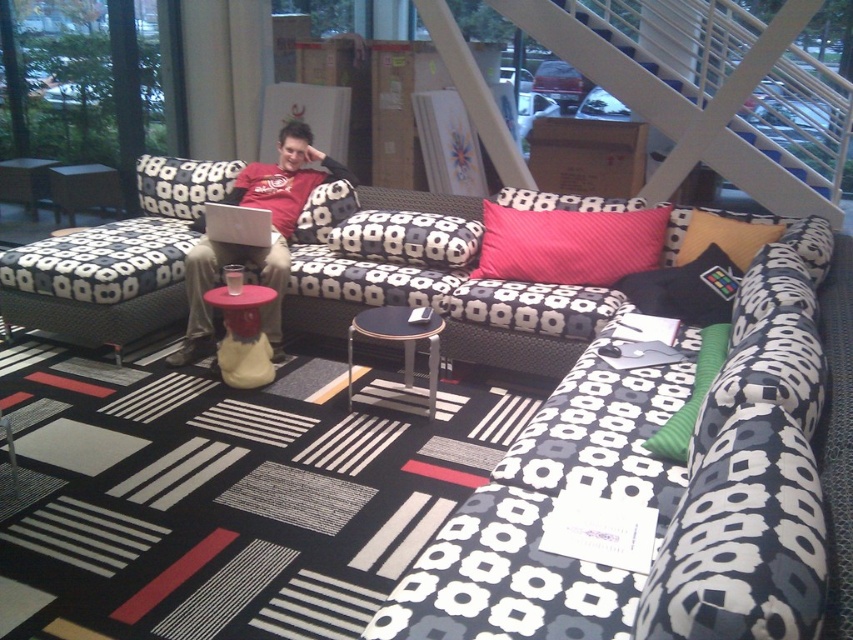
Can you confirm if red matte shirt at center is wider than green fabric pillow at center?

Yes, red matte shirt at center is wider than green fabric pillow at center.

Does point (305, 179) lie in front of point (668, 445)?

No, it is not.

Who is more distant from viewer, (x=202, y=314) or (x=668, y=460)?

Point (x=202, y=314)

The height and width of the screenshot is (640, 853). Find the location of `red matte shirt at center`. red matte shirt at center is located at coordinates (254, 246).

Is pink fabric pillow at center to the left of matte plastic stool at center from the viewer's perspective?

In fact, pink fabric pillow at center is to the right of matte plastic stool at center.

Who is more forward, (x=370, y=212) or (x=262, y=358)?

Point (x=262, y=358)

Is point (447, 220) more distant than point (248, 342)?

Yes, it is.

Locate an element on the screen. pink fabric pillow at center is located at coordinates (408, 237).

Who is shorter, matte plastic stool at center or pink textured pillow at center?

pink textured pillow at center is shorter.

Locate an element on the screen. The height and width of the screenshot is (640, 853). matte plastic stool at center is located at coordinates (242, 337).